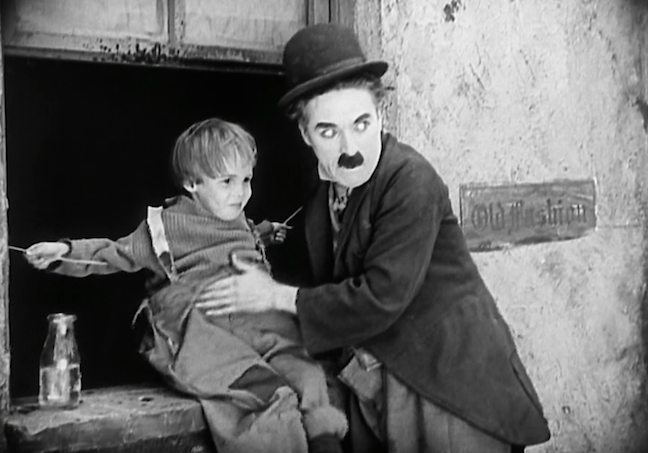
In order to click on glass bottle in this screenshot , I will do `click(67, 354)`.